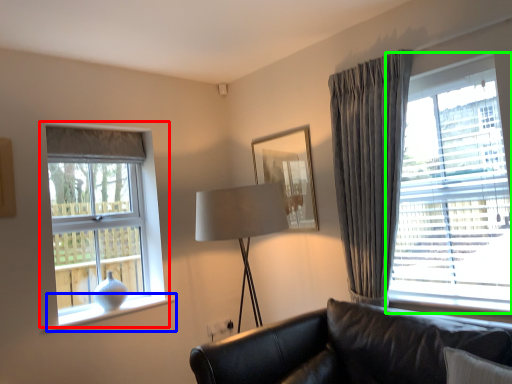
Question: Which object is the farthest from window (highlighted by a red box)? Choose among these: window sill (highlighted by a blue box) or window (highlighted by a green box).

Choices:
 (A) window sill
 (B) window

Answer: (B)